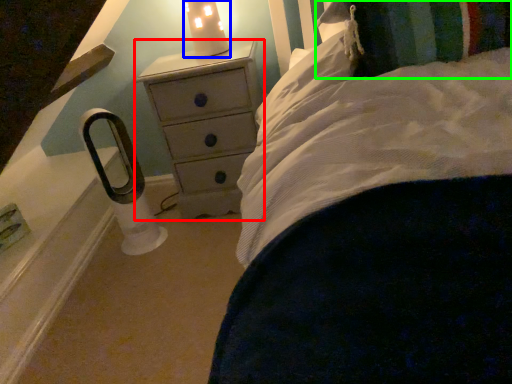
Question: Which is nearer to the chest of drawers (highlighted by a red box)? candle holder (highlighted by a blue box) or pillow (highlighted by a green box).

Choices:
 (A) candle holder
 (B) pillow

Answer: (A)